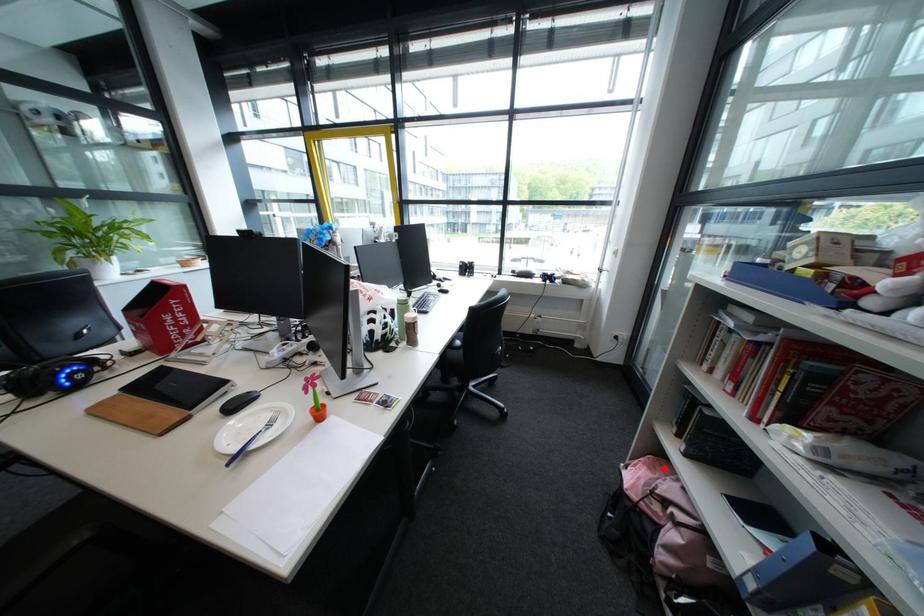
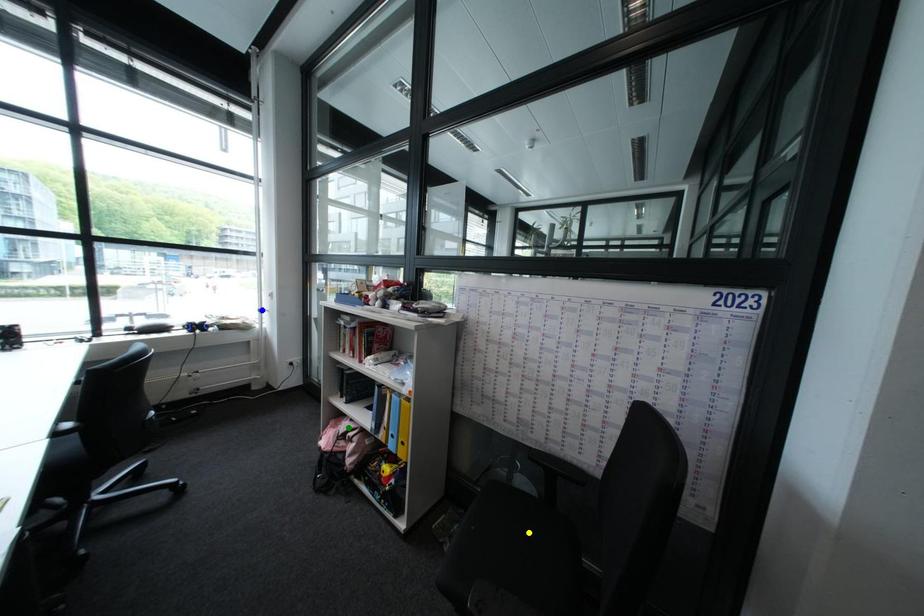
Question: I am providing you with two images of the same scene from different viewpoints. A red point is marked on the first image. You are given multiple points on the second image. Which point in image 2 is actually the same real-world point as the red point in image 1?

Choices:
 (A) green point
 (B) blue point
 (C) yellow point

Answer: (A)